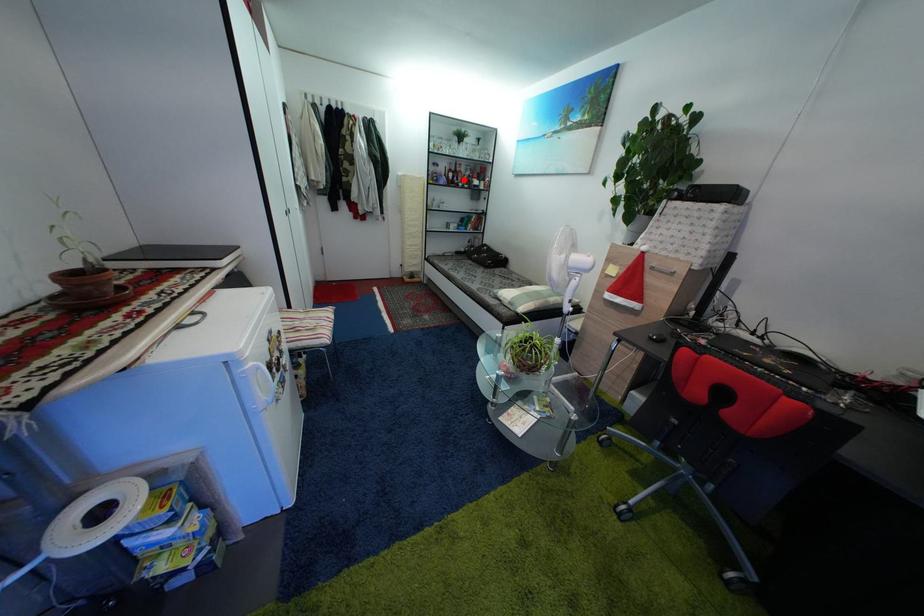
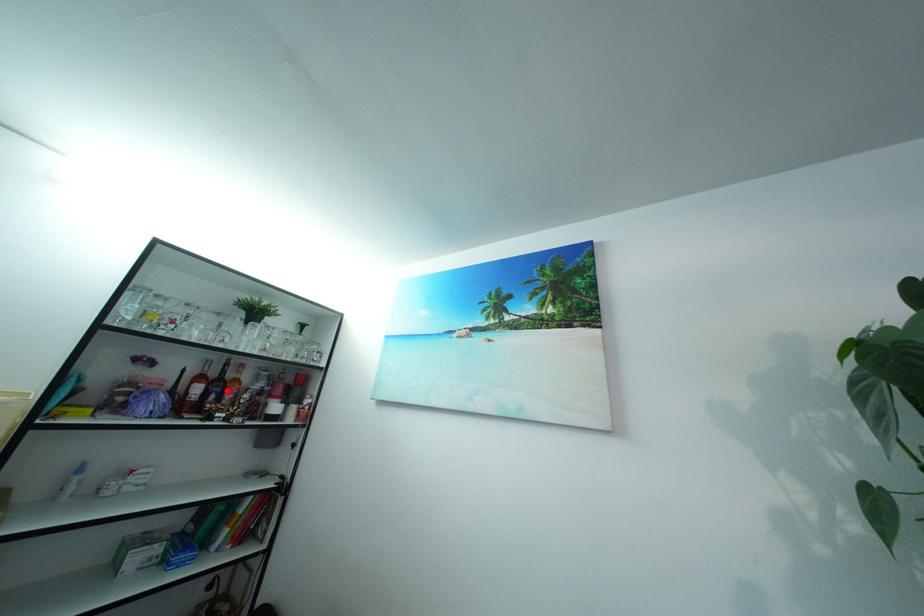
From the picture: I am providing you with two images of the same scene from different viewpoints. A red point is marked on the first image and another point is marked on the second image. Is the marked point in image1 the same physical position as the marked point in image2?

Yes